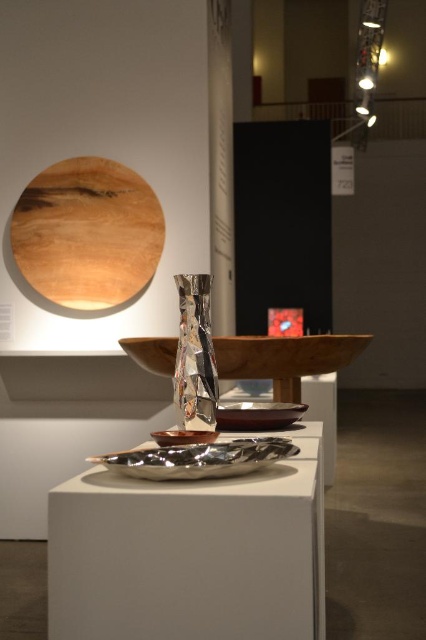
Does silver metallic tray at center come behind wooden circle at upper left?

No, silver metallic tray at center is closer to the viewer.

Is silver metallic tray at center smaller than wooden circle at upper left?

Actually, silver metallic tray at center might be larger than wooden circle at upper left.

Who is more distant from viewer, (192, 605) or (138, 212)?

Positioned behind is point (138, 212).

This screenshot has height=640, width=426. What are the coordinates of `silver metallic tray at center` in the screenshot? It's located at (190, 554).

Who is lower down, silver reflective platter at center or shiny metallic bowl at center?

shiny metallic bowl at center

Does silver reflective platter at center appear on the right side of shiny metallic bowl at center?

Yes, silver reflective platter at center is to the right of shiny metallic bowl at center.

Between point (187, 470) and point (150, 433), which one is positioned in front?

Positioned in front is point (187, 470).

In order to click on silver reflective platter at center in this screenshot , I will do `click(199, 458)`.

Which is more to the right, silver metallic tray at center or shiny metallic bowl at center?

silver metallic tray at center

The height and width of the screenshot is (640, 426). I want to click on silver metallic tray at center, so click(x=190, y=554).